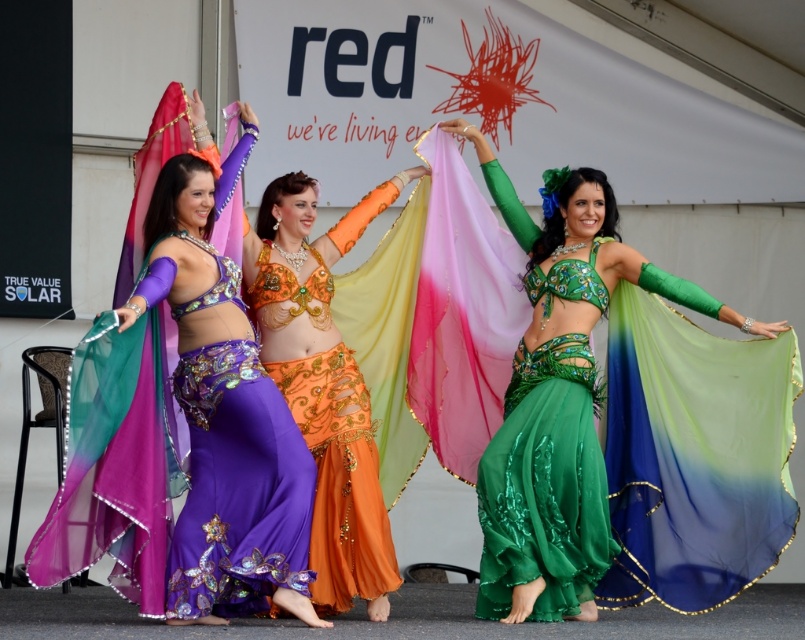
Question: Among these points, which one is farthest from the camera?

Choices:
 (A) (597, 522)
 (B) (308, 454)
 (C) (345, 497)

Answer: (C)

Question: Is green satin belly dancer at center smaller than green satin dress at center?

Choices:
 (A) no
 (B) yes

Answer: (A)

Question: Is green satin belly dancer at center closer to camera compared to orange satin skirt at center?

Choices:
 (A) yes
 (B) no

Answer: (B)

Question: Considering the real-world distances, which object is farthest from the orange satin skirt at center?

Choices:
 (A) purple satin belly dancer at center
 (B) green satin dress at center
 (C) green satin belly dancer at center

Answer: (C)

Question: Does green satin belly dancer at center appear over green satin dress at center?

Choices:
 (A) no
 (B) yes

Answer: (B)

Question: Estimate the real-world distances between objects in this image. Which object is closer to the orange satin skirt at center?

Choices:
 (A) green satin dress at center
 (B) purple satin belly dancer at center
 (C) green satin belly dancer at center

Answer: (B)